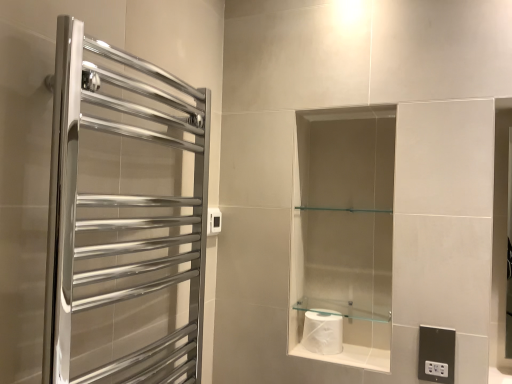
Question: Considering the positions of clear glass shelf at center and white glossy toilet paper at center in the image, is clear glass shelf at center taller or shorter than white glossy toilet paper at center?

Choices:
 (A) tall
 (B) short

Answer: (B)

Question: Considering their positions, is clear glass shelf at center located in front of or behind white glossy toilet paper at center?

Choices:
 (A) behind
 (B) front

Answer: (B)

Question: Considering the real-world distances, which object is farthest from the white plastic electric outlet at upper center, positioned as the 1th electric outlet in top-to-bottom order?

Choices:
 (A) polished chrome towel rack at left
 (B) white glossy toilet paper at lower center
 (C) clear glass shelf at center
 (D) white glossy toilet paper at center
 (E) black plastic electrical outlet at lower right, which ranks as the 1th electric outlet in right-to-left order

Answer: (E)

Question: Estimate the real-world distances between objects in this image. Which object is farther from the white plastic electric outlet at upper center, placed as the 2th electric outlet when sorted from front to back?

Choices:
 (A) white glossy toilet paper at lower center
 (B) white glossy toilet paper at center
 (C) black plastic electrical outlet at lower right, the second electric outlet in the top-to-bottom sequence
 (D) polished chrome towel rack at left
 (E) clear glass shelf at center

Answer: (C)